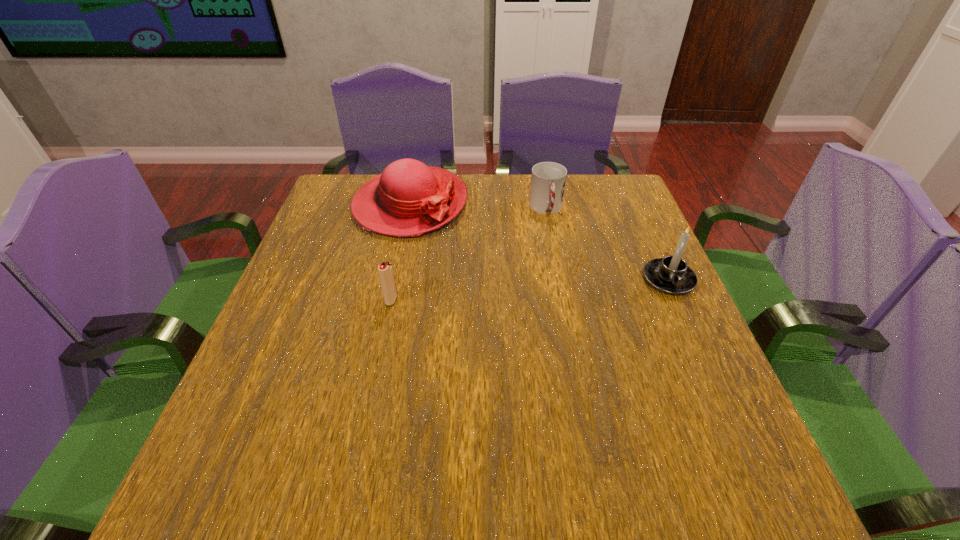
The width and height of the screenshot is (960, 540). What are the coordinates of `vacant area situated 0.060m on the side of the third object from left to right where the handle is located` in the screenshot? It's located at (553, 237).

Identify the location of free space located on the side of the third object from left to right where the handle is located. Image resolution: width=960 pixels, height=540 pixels. (558, 256).

Identify the location of vacant region located 0.310m on the side of the third object from left to right where the handle is located. (571, 307).

The width and height of the screenshot is (960, 540). I want to click on hat that is positioned at the far edge, so click(x=408, y=198).

The width and height of the screenshot is (960, 540). In order to click on cup that is at the far edge in this screenshot , I will do `click(548, 179)`.

The image size is (960, 540). I want to click on object situated at the left edge, so click(408, 198).

Where is `object that is at the right edge`? object that is at the right edge is located at coordinates (671, 275).

You are a GUI agent. You are given a task and a screenshot of the screen. Output one action in this format:
    pyautogui.click(x=<x>, y=<y>)
    Task: Click on the object that is at the far left corner
    The width and height of the screenshot is (960, 540).
    Given the screenshot: What is the action you would take?
    pyautogui.click(x=408, y=198)

Locate an element on the screen. This screenshot has width=960, height=540. free space at the far edge of the desktop is located at coordinates (491, 200).

What are the coordinates of `free space at the near edge of the desktop` in the screenshot? It's located at (557, 424).